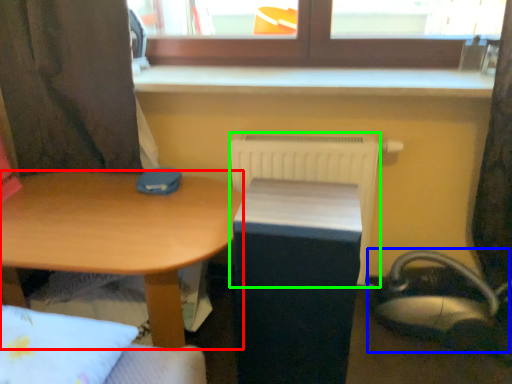
Question: Based on their relative distances, which object is farther from desk (highlighted by a red box)? Choose from swivel chair (highlighted by a blue box) and radiator (highlighted by a green box).

Choices:
 (A) swivel chair
 (B) radiator

Answer: (A)